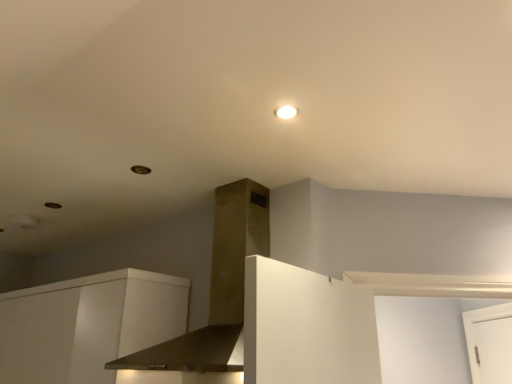
Identify the location of white matte cabinet at lower left. (87, 324).

What is the approximate height of white glossy light fixture at upper center?

0.84 inches.

What do you see at coordinates (217, 287) in the screenshot? I see `satin gold vent at center` at bounding box center [217, 287].

Where is `white matte cabinet at lower left`? white matte cabinet at lower left is located at coordinates (87, 324).

Looking at this image, from the image's perspective, which object appears higher, satin gold vent at center or white matte cabinet at lower left?

satin gold vent at center is shown above in the image.

In terms of height, does satin gold vent at center look taller or shorter compared to white matte cabinet at lower left?

Considering their sizes, satin gold vent at center has more height than white matte cabinet at lower left.

Is point (188, 360) farther from camera compared to point (164, 337)?

No, it is not.

Could you tell me if satin gold vent at center is turned towards white matte cabinet at lower left?

No, satin gold vent at center is not facing towards white matte cabinet at lower left.

Considering the positions of point (283, 116) and point (242, 284), is point (283, 116) closer or farther from the camera than point (242, 284)?

Point (283, 116) appears to be closer to the viewer than point (242, 284).

From the image's perspective, would you say white glossy light fixture at upper center is shown under satin gold vent at center?

Actually, white glossy light fixture at upper center appears above satin gold vent at center in the image.

Is satin gold vent at center at the back of white glossy light fixture at upper center?

Yes, satin gold vent at center is at the back of white glossy light fixture at upper center.

Are white glossy light fixture at upper center and satin gold vent at center far apart?

That's not correct — white glossy light fixture at upper center is a little close to satin gold vent at center.

Is white matte cabinet at lower left spatially inside white glossy light fixture at upper center, or outside of it?

white matte cabinet at lower left is not enclosed by white glossy light fixture at upper center.

Based on the photo, is white matte cabinet at lower left positioned with its back to white glossy light fixture at upper center?

No, white matte cabinet at lower left is not facing the opposite direction of white glossy light fixture at upper center.

Are white matte cabinet at lower left and white glossy light fixture at upper center located far from each other?

Absolutely, white matte cabinet at lower left is distant from white glossy light fixture at upper center.

Which object is positioned more to the left, white matte cabinet at lower left or white glossy light fixture at upper center?

white matte cabinet at lower left.

Where is `lighting behind the satin gold vent at center`? lighting behind the satin gold vent at center is located at coordinates (286, 112).

Consider the image. Does satin gold vent at center have a smaller size compared to white glossy light fixture at upper center?

No, satin gold vent at center is not smaller than white glossy light fixture at upper center.

Does point (217, 265) come behind point (281, 111)?

Yes, it is.

Consider the image. In the image, is satin gold vent at center positioned in front of or behind white glossy light fixture at upper center?

Visually, satin gold vent at center is located in front of white glossy light fixture at upper center.

Considering the relative sizes of white glossy light fixture at upper center and white matte cabinet at lower left in the image provided, is white glossy light fixture at upper center thinner than white matte cabinet at lower left?

Correct, the width of white glossy light fixture at upper center is less than that of white matte cabinet at lower left.

Is white matte cabinet at lower left at the back of white glossy light fixture at upper center?

No.

Does white glossy light fixture at upper center have a greater height compared to white matte cabinet at lower left?

Incorrect, the height of white glossy light fixture at upper center is not larger of that of white matte cabinet at lower left.

From the image's perspective, which one is positioned higher, white glossy light fixture at upper center or white matte cabinet at lower left?

white glossy light fixture at upper center appears higher in the image.

Is white matte cabinet at lower left thinner than satin gold vent at center?

Correct, the width of white matte cabinet at lower left is less than that of satin gold vent at center.

Is white matte cabinet at lower left to the left or to the right of satin gold vent at center in the image?

In the image, white matte cabinet at lower left appears on the left side of satin gold vent at center.

Is satin gold vent at center at the back of white matte cabinet at lower left?

That's not correct — white matte cabinet at lower left is not looking away from satin gold vent at center.

From the image's perspective, between white matte cabinet at lower left and satin gold vent at center, which one is located above?

satin gold vent at center is shown above in the image.

There is a white matte cabinet at lower left. Identify the location of vent above it (from a real-world perspective). (217, 287).

At what (x,y) coordinates should I click in order to perform the action: click on vent directly beneath the white glossy light fixture at upper center (from a real-world perspective). Please return your answer as a coordinate pair (x, y). Looking at the image, I should click on (217, 287).

Looking at the image, which one is located closer to white matte cabinet at lower left, white glossy light fixture at upper center or satin gold vent at center?

The object closer to white matte cabinet at lower left is satin gold vent at center.

Based on the photo, from the image, which object appears to be farther from white glossy light fixture at upper center, satin gold vent at center or white matte cabinet at lower left?

Among the two, white matte cabinet at lower left is located further to white glossy light fixture at upper center.

Considering their positions, is satin gold vent at center positioned further to white matte cabinet at lower left than white glossy light fixture at upper center?

Based on the image, white glossy light fixture at upper center appears to be further to white matte cabinet at lower left.

When comparing their distances from satin gold vent at center, does white glossy light fixture at upper center or white matte cabinet at lower left seem closer?

Among the two, white matte cabinet at lower left is located nearer to satin gold vent at center.

Considering their positions, is white matte cabinet at lower left positioned further to white glossy light fixture at upper center than satin gold vent at center?

white matte cabinet at lower left is positioned further to the anchor white glossy light fixture at upper center.

Considering their positions, is white matte cabinet at lower left positioned closer to satin gold vent at center than white glossy light fixture at upper center?

white matte cabinet at lower left is closer to satin gold vent at center.

Identify the location of vent situated between white matte cabinet at lower left and white glossy light fixture at upper center from left to right. (217, 287).